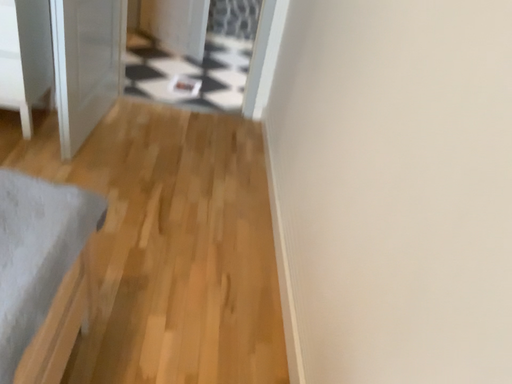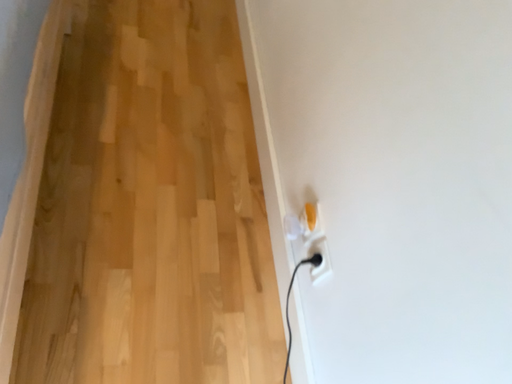
Question: How did the camera likely rotate when shooting the video?

Choices:
 (A) rotated left
 (B) rotated right

Answer: (B)